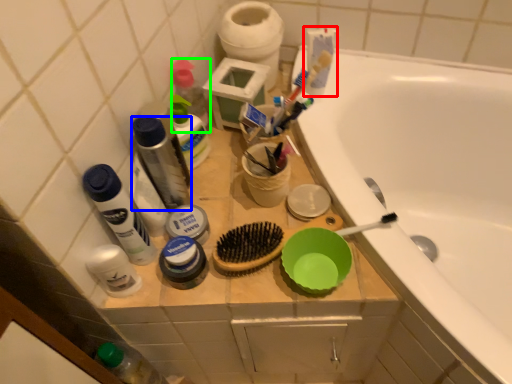
Question: Which is nearer to the toothpaste (highlighted by a red box)? mouthwash (highlighted by a blue box) or toiletry (highlighted by a green box).

Choices:
 (A) mouthwash
 (B) toiletry

Answer: (B)